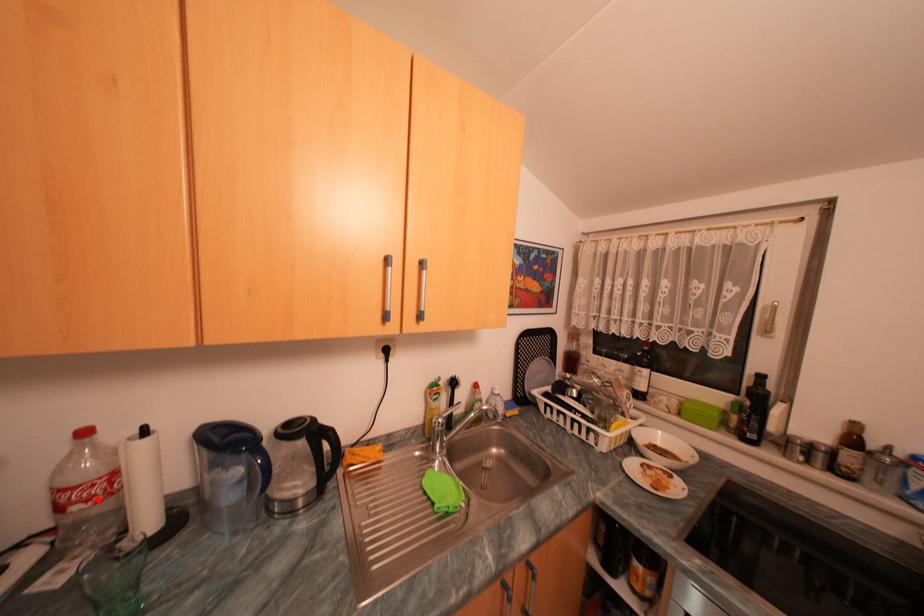
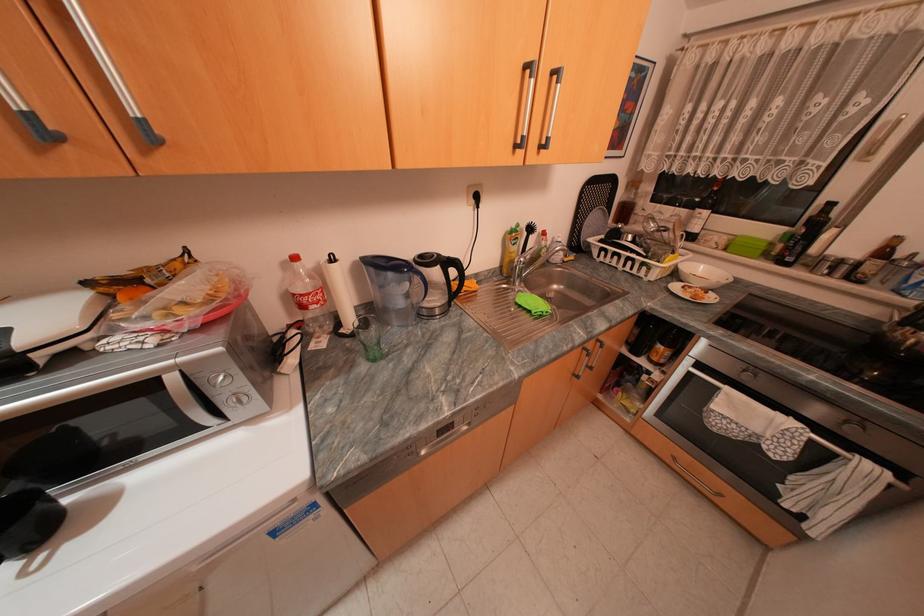
Where in the second image is the point corresponding to the highlighted location from the first image?

(326, 302)